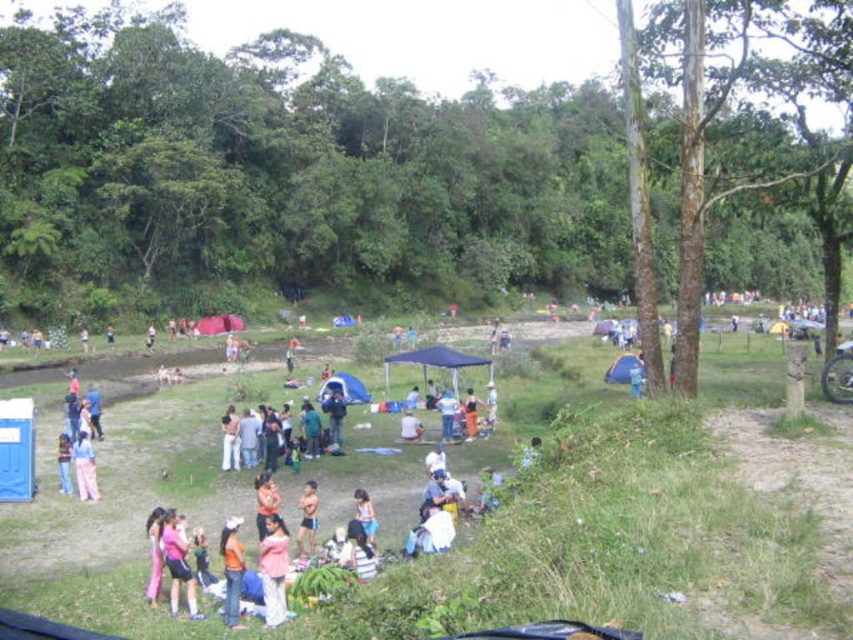
Question: Which is farther from the pink fabric at lower center?

Choices:
 (A) pink fabric at center
 (B) pink fabric dress at lower left

Answer: (A)

Question: Among these objects, which one is farthest from the camera?

Choices:
 (A) pink fabric at center
 (B) orange fabric shirt at lower center

Answer: (A)

Question: Based on their relative distances, which object is nearer to the orange fabric shirt at lower center?

Choices:
 (A) pink fabric pants at lower left
 (B) pink fabric dress at lower left
 (C) pink fabric at lower center

Answer: (C)

Question: Is pink fabric pants at lower left above pink fabric at center?

Choices:
 (A) yes
 (B) no

Answer: (A)

Question: Does pink fabric dress at lower left appear on the right side of pink fabric pants at lower left?

Choices:
 (A) yes
 (B) no

Answer: (A)

Question: Can you confirm if pink fabric at lower center is smaller than pink fabric at center?

Choices:
 (A) yes
 (B) no

Answer: (B)